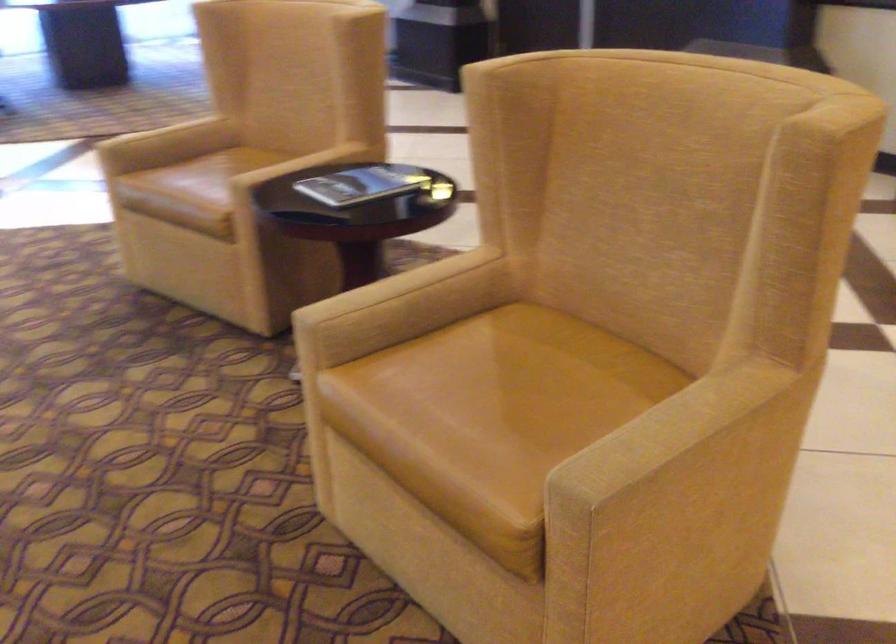
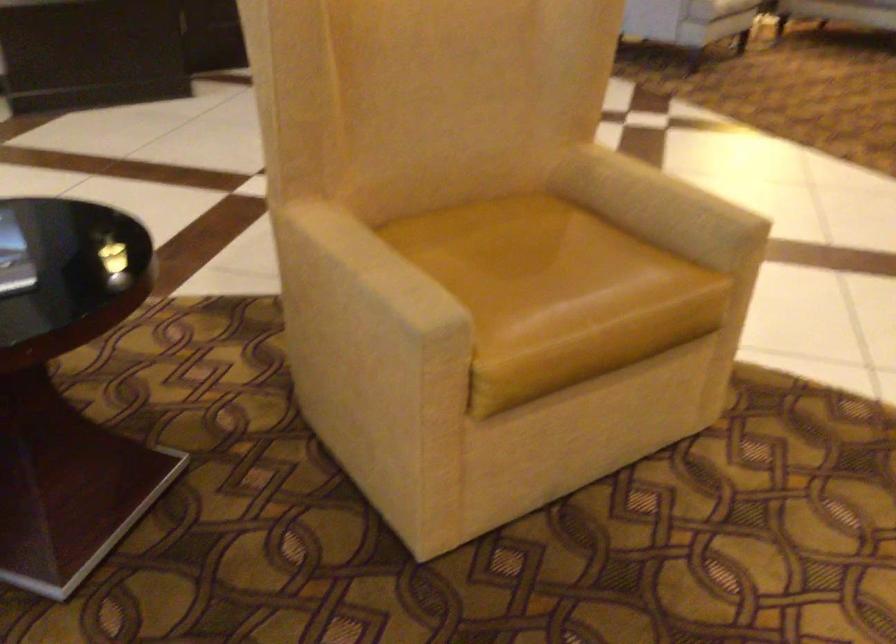
Where in the second image is the point corresponding to [641,430] from the first image?

(659, 205)